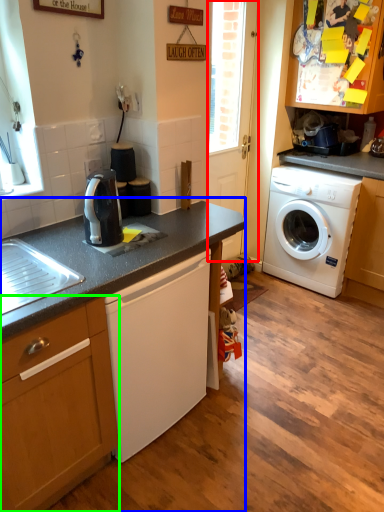
Question: Which object is the farthest from screen door (highlighted by a red box)? Choose among these: countertop (highlighted by a blue box) or cabinetry (highlighted by a green box).

Choices:
 (A) countertop
 (B) cabinetry

Answer: (B)